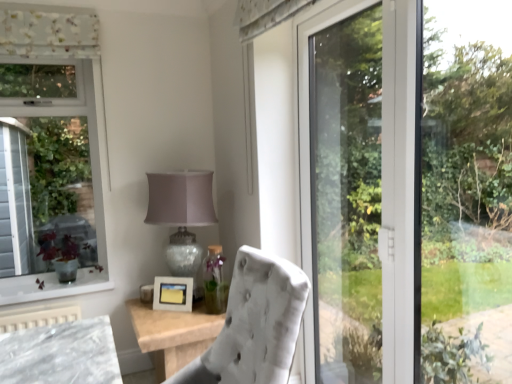
Question: From the image's perspective, would you say transparent glass door at right is shown under velvet white chair at center?

Choices:
 (A) no
 (B) yes

Answer: (A)

Question: Can you confirm if transparent glass door at right is wider than velvet white chair at center?

Choices:
 (A) no
 (B) yes

Answer: (A)

Question: Can you confirm if transparent glass door at right is bigger than velvet white chair at center?

Choices:
 (A) yes
 (B) no

Answer: (B)

Question: Is velvet white chair at center inside transparent glass door at right?

Choices:
 (A) yes
 (B) no

Answer: (B)

Question: Are transparent glass door at right and velvet white chair at center far apart?

Choices:
 (A) no
 (B) yes

Answer: (A)

Question: Is matte glass table lamp at center in front of or behind transparent glass door at right in the image?

Choices:
 (A) front
 (B) behind

Answer: (B)

Question: Which is correct: matte glass table lamp at center is inside transparent glass door at right, or outside of it?

Choices:
 (A) outside
 (B) inside

Answer: (A)

Question: In terms of width, does matte glass table lamp at center look wider or thinner when compared to transparent glass door at right?

Choices:
 (A) thin
 (B) wide

Answer: (B)

Question: From the image's perspective, relative to transparent glass door at right, is matte glass table lamp at center above or below?

Choices:
 (A) below
 (B) above

Answer: (A)

Question: Would you say velvet white chair at center is to the left or to the right of white matte picture frame at center in the picture?

Choices:
 (A) left
 (B) right

Answer: (B)

Question: Based on their sizes in the image, would you say velvet white chair at center is bigger or smaller than white matte picture frame at center?

Choices:
 (A) small
 (B) big

Answer: (B)

Question: Considering the positions of point (292, 307) and point (186, 286), is point (292, 307) closer or farther from the camera than point (186, 286)?

Choices:
 (A) closer
 (B) farther

Answer: (A)

Question: From a real-world perspective, is velvet white chair at center positioned above or below white matte picture frame at center?

Choices:
 (A) above
 (B) below

Answer: (A)

Question: Considering the positions of point (153, 200) and point (155, 294), is point (153, 200) closer or farther from the camera than point (155, 294)?

Choices:
 (A) farther
 (B) closer

Answer: (B)

Question: Based on their sizes in the image, would you say matte glass table lamp at center is bigger or smaller than white matte picture frame at center?

Choices:
 (A) small
 (B) big

Answer: (B)